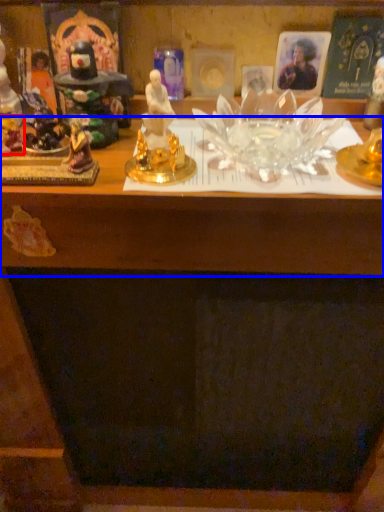
Question: Which point is further to the camera, toy (highlighted by a red box) or table (highlighted by a blue box)?

Choices:
 (A) toy
 (B) table

Answer: (A)